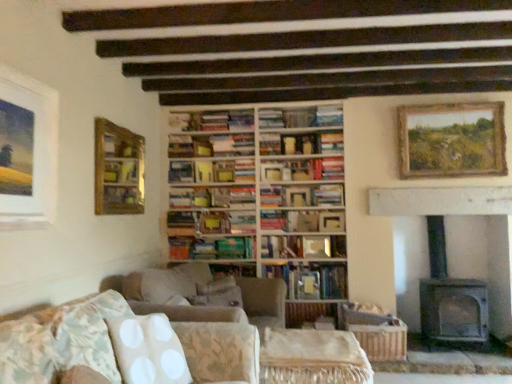
I want to click on blank space situated above matte white picture frame at upper left, which is the first picture frame in left-to-right order (from a real-world perspective), so click(20, 75).